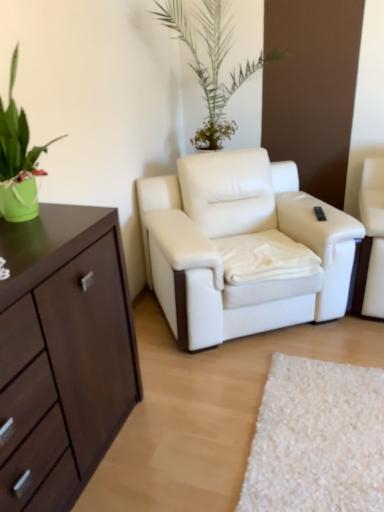
Question: Should I look upward or downward to see white leather armchair at center?

Choices:
 (A) down
 (B) up

Answer: (B)

Question: Is black plastic remote control at upper right next to white leather armchair at center?

Choices:
 (A) no
 (B) yes

Answer: (A)

Question: From the image's perspective, would you say black plastic remote control at upper right is positioned over white leather armchair at center?

Choices:
 (A) no
 (B) yes

Answer: (B)

Question: Does black plastic remote control at upper right appear on the right side of white leather armchair at center?

Choices:
 (A) no
 (B) yes

Answer: (B)

Question: Can you confirm if black plastic remote control at upper right is bigger than white leather armchair at center?

Choices:
 (A) no
 (B) yes

Answer: (A)

Question: Is black plastic remote control at upper right facing away from white leather armchair at center?

Choices:
 (A) yes
 (B) no

Answer: (A)

Question: Is black plastic remote control at upper right shorter than white leather armchair at center?

Choices:
 (A) yes
 (B) no

Answer: (A)

Question: Can you confirm if white leather armchair at center is bigger than green matte pot at left?

Choices:
 (A) yes
 (B) no

Answer: (A)

Question: Is white leather armchair at center at the right side of green matte pot at left?

Choices:
 (A) no
 (B) yes

Answer: (B)

Question: From a real-world perspective, is white leather armchair at center physically below green matte pot at left?

Choices:
 (A) no
 (B) yes

Answer: (B)

Question: Is white leather armchair at center to the left of green matte pot at left from the viewer's perspective?

Choices:
 (A) yes
 (B) no

Answer: (B)

Question: Is white leather armchair at center further to camera compared to green matte pot at left?

Choices:
 (A) yes
 (B) no

Answer: (A)

Question: Is green matte pot at left at the back of white leather armchair at center?

Choices:
 (A) no
 (B) yes

Answer: (A)

Question: Does black plastic remote control at upper right have a larger size compared to green matte pot at left?

Choices:
 (A) no
 (B) yes

Answer: (A)